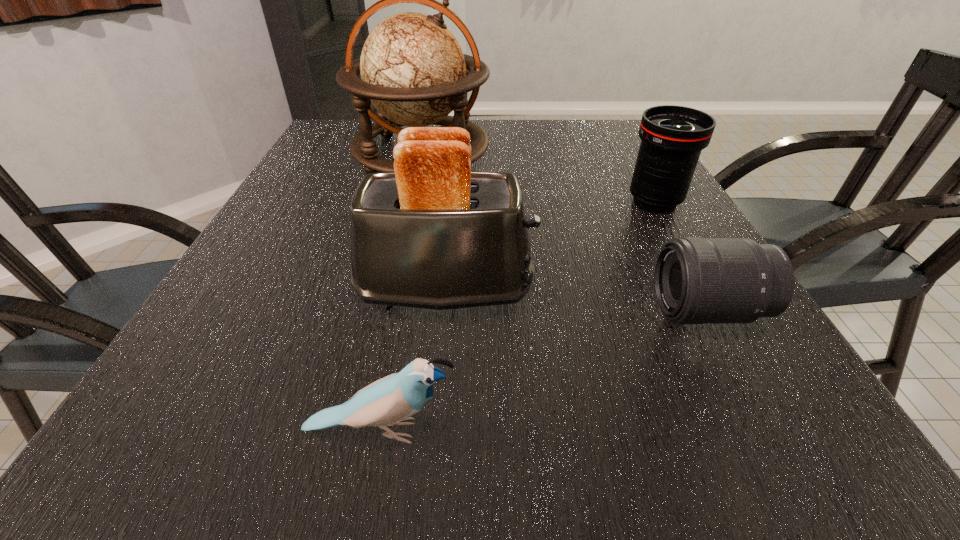
Where is `free region at the left edge`? The image size is (960, 540). free region at the left edge is located at coordinates (277, 303).

Where is `vacant area at the right edge of the desktop`? This screenshot has width=960, height=540. vacant area at the right edge of the desktop is located at coordinates (629, 158).

I want to click on vacant space at the near left corner, so click(x=229, y=425).

The height and width of the screenshot is (540, 960). I want to click on vacant area at the far right corner of the desktop, so click(x=629, y=151).

At what (x,y) coordinates should I click in order to perform the action: click on vacant space at the near right corner. Please return your answer as a coordinate pair (x, y). Image resolution: width=960 pixels, height=540 pixels. Looking at the image, I should click on (721, 456).

At what (x,y) coordinates should I click in order to perform the action: click on vacant region between the taller telephoto lens and the tallest object. Please return your answer as a coordinate pair (x, y). The width and height of the screenshot is (960, 540). Looking at the image, I should click on (538, 177).

Find the location of a particular element. This screenshot has height=540, width=960. vacant space that is in between the shorter telephoto lens and the fourth shortest object is located at coordinates (576, 301).

Image resolution: width=960 pixels, height=540 pixels. I want to click on empty space between the nearer telephoto lens and the tallest object, so click(x=564, y=232).

Locate an element on the screen. Image resolution: width=960 pixels, height=540 pixels. unoccupied position between the bird and the nearer telephoto lens is located at coordinates (544, 371).

You are a GUI agent. You are given a task and a screenshot of the screen. Output one action in this format:
    pyautogui.click(x=<x>, y=<y>)
    Task: Click on the free point between the third tallest object and the bird
    The image size is (960, 540).
    Given the screenshot: What is the action you would take?
    pyautogui.click(x=517, y=316)